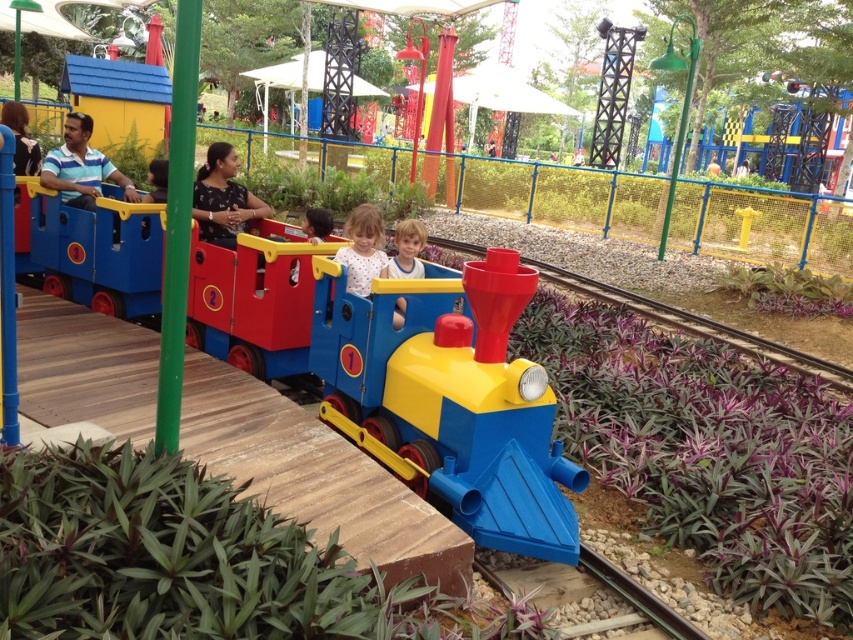
You are standing at the entrance of the amusement park and see the matte plastic train at center. If you want to walk towards it, how many steps would you need to take if each step covers about 2.5 feet?

The matte plastic train at center is 10.81 feet away from you. Since each step covers about 2.5 feet, you would need to take approximately 4 steps to reach it.

You are standing at the edge of the platform in the children amusement park and want to walk to the train. There are two points marked on the ground in front of you. The first point is at point (431,378) and the second point is at point (360,220). Which point is closer to you?

Point (431,378) is closer to the viewer than point (360,220).

From the picture: You are a parent trying to decide whether to let your child play on the matte plastic train at center while wearing their smooth blue shirt at center. Based on the height of the train and the shirt, will the shirt get dirty from the train?

The matte plastic train at center is taller than the smooth blue shirt at center, so the shirt is unlikely to get dirty from the train since it is shorter than the train.